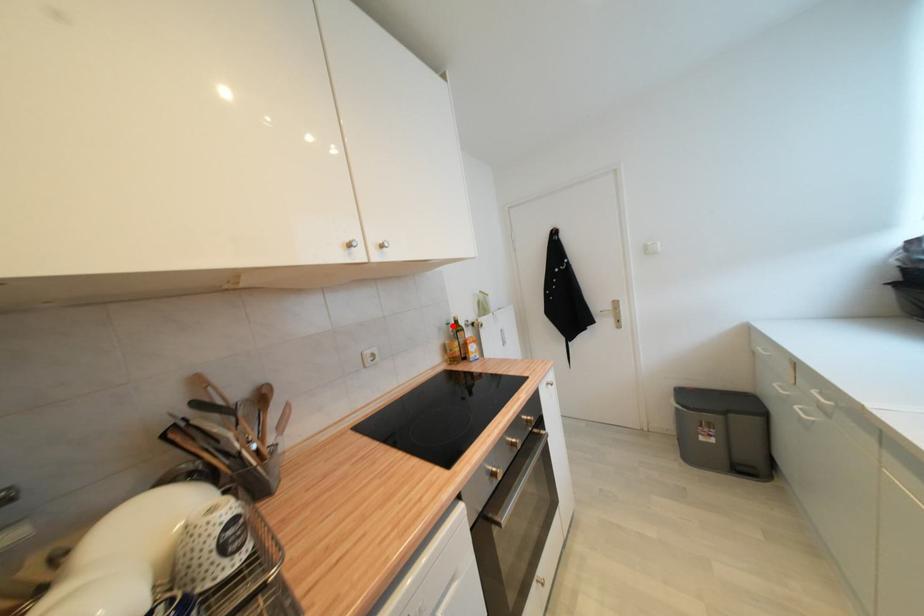
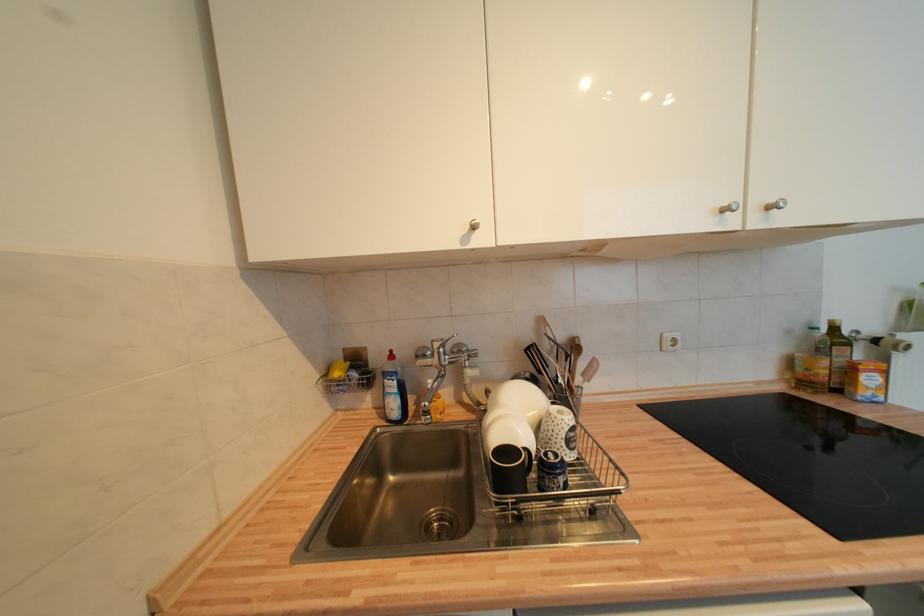
Find the pixel in the second image that matches the highlighted location in the first image.

(819, 331)